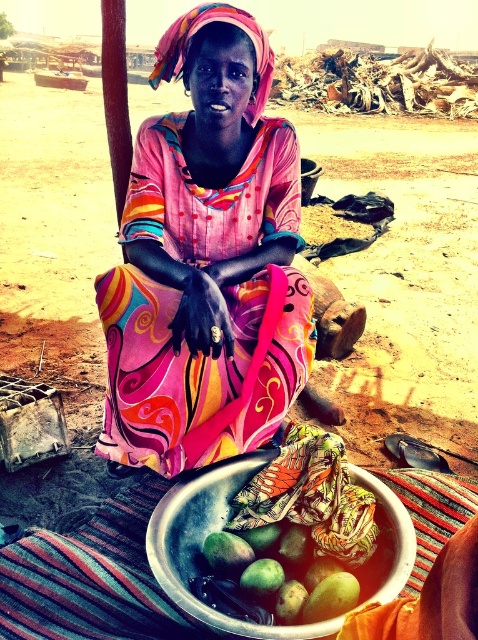
Does matte pink dress at center have a larger size compared to green matte mangoes at lower center?

Yes.

Between point (249, 205) and point (303, 582), which one is positioned behind?

Point (249, 205)

Is point (193, 244) positioned after point (303, 608)?

Yes, it is.

The width and height of the screenshot is (478, 640). In order to click on matte pink dress at center in this screenshot , I will do `click(206, 260)`.

Who is positioned more to the right, matte pink dress at center or metallic silver bowl at lower center?

metallic silver bowl at lower center is more to the right.

Can you confirm if matte pink dress at center is positioned to the left of metallic silver bowl at lower center?

Indeed, matte pink dress at center is positioned on the left side of metallic silver bowl at lower center.

You are a GUI agent. You are given a task and a screenshot of the screen. Output one action in this format:
    pyautogui.click(x=<x>, y=<y>)
    Task: Click on the matte pink dress at center
    The width and height of the screenshot is (478, 640).
    Given the screenshot: What is the action you would take?
    pyautogui.click(x=206, y=260)

Who is positioned more to the left, metallic silver bowl at lower center or green matte mangoes at lower center?

From the viewer's perspective, green matte mangoes at lower center appears more on the left side.

Is point (202, 532) positioned after point (288, 604)?

Yes, point (202, 532) is behind point (288, 604).

Is point (391, 598) positioned behind point (239, 557)?

No, (391, 598) is in front of (239, 557).

Find the location of `metallic silver bowl at lower center`. metallic silver bowl at lower center is located at coordinates (201, 547).